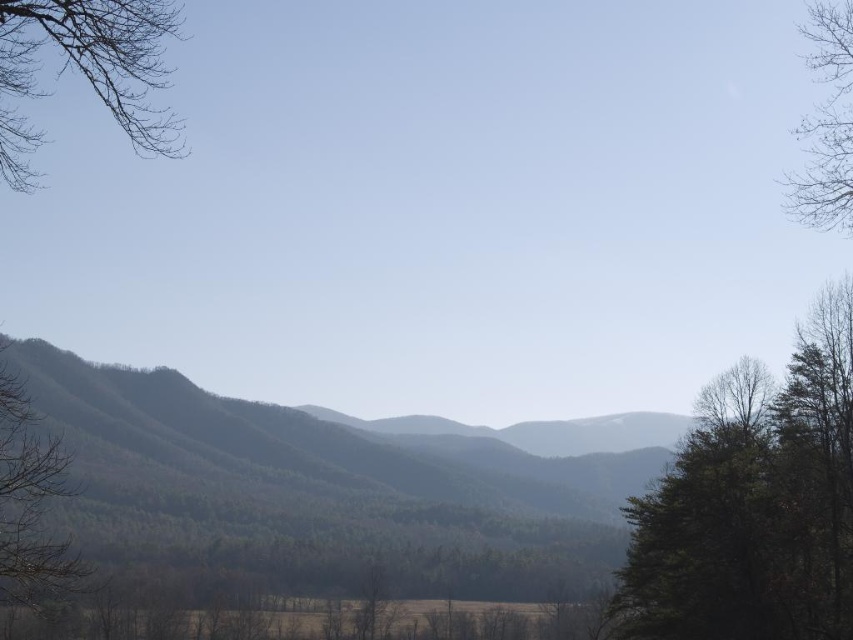
Question: Can you confirm if green leafy tree at right is wider than bare branches at upper left?

Choices:
 (A) no
 (B) yes

Answer: (A)

Question: Among these points, which one is farthest from the camera?

Choices:
 (A) 111,1
 (B) 611,548
 (C) 814,368

Answer: (B)

Question: Is green forested mountain at center above green matte tree at left?

Choices:
 (A) no
 (B) yes

Answer: (A)

Question: Is bare branches at upper left above bare branches at upper right?

Choices:
 (A) yes
 (B) no

Answer: (A)

Question: Among these points, which one is nearest to the camera?

Choices:
 (A) (824, 147)
 (B) (42, 502)

Answer: (B)

Question: Which object is the closest to the bare branches at upper right?

Choices:
 (A) green forested mountain at center
 (B) bare branches at upper left

Answer: (A)